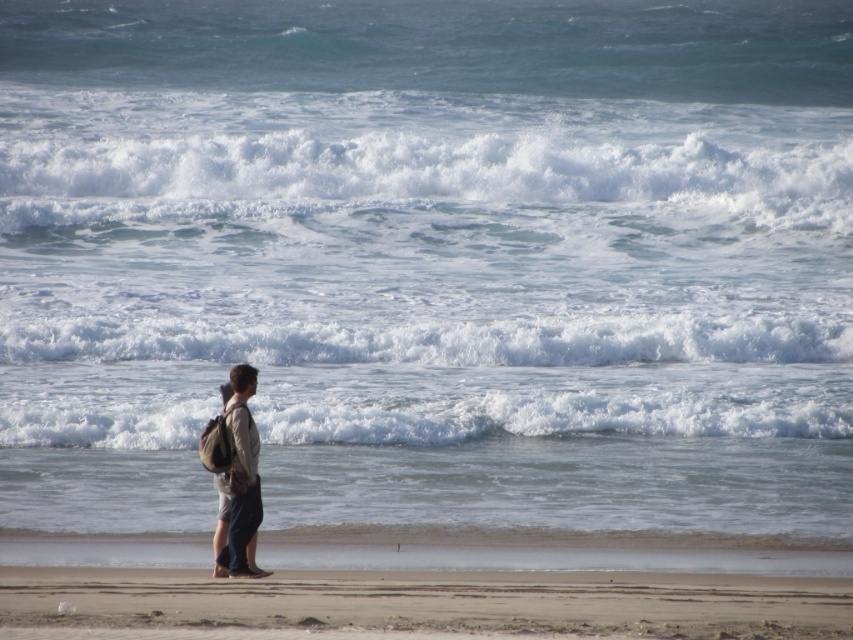
Question: Which point appears farthest from the camera in this image?

Choices:
 (A) (727, 141)
 (B) (25, 596)

Answer: (A)

Question: Is sandy beach at lower center below light brown fabric backpack at center?

Choices:
 (A) yes
 (B) no

Answer: (A)

Question: Is white frothy wave at upper center to the left of light brown fabric backpack at center from the viewer's perspective?

Choices:
 (A) yes
 (B) no

Answer: (B)

Question: Which object appears closest to the camera in this image?

Choices:
 (A) sandy beach at lower center
 (B) light brown fabric backpack at center

Answer: (A)

Question: Considering the real-world distances, which object is closest to the light brown fabric backpack at center?

Choices:
 (A) white frothy wave at upper center
 (B) sandy beach at lower center

Answer: (B)

Question: Does sandy beach at lower center appear on the right side of light brown fabric backpack at center?

Choices:
 (A) yes
 (B) no

Answer: (A)